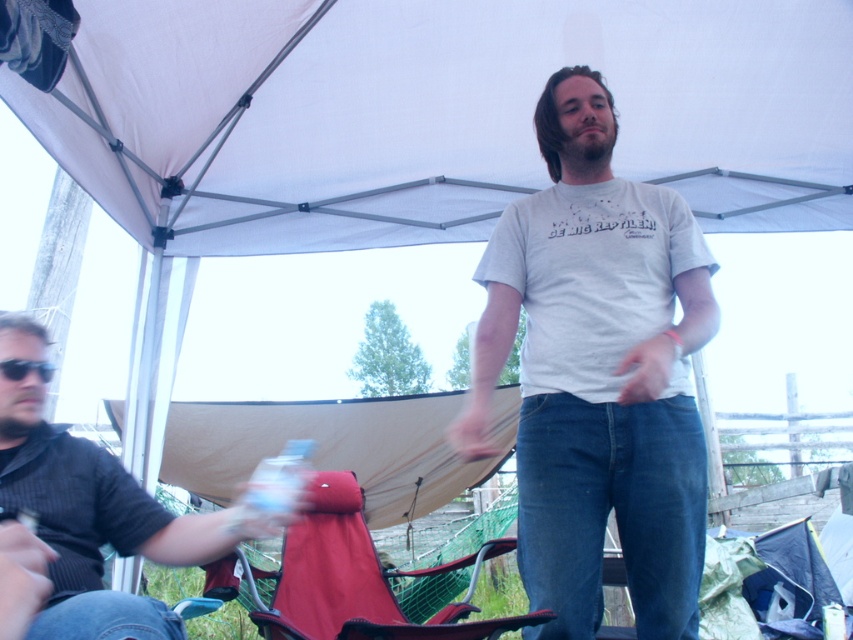
You are standing at the point marked by coordinates point (805, 76) and want to walk towards the point marked by coordinates point (3, 448). Will you have to go forward or backward to reach your destination?

Since point (805, 76) is behind point (3, 448), you will have to go forward to reach the destination.

You are standing at the point with coordinates (352, 579) in the image. What object is right there?

The matte red folding chair at lower center is located at point (352, 579).

You are a person who needs to reach the black plastic sunglasses at left from the matte red folding chair at lower center. Can you do it without moving more than 5 feet?

The matte red folding chair at lower center is 5.05 feet away from the black plastic sunglasses at left, so you cannot reach the black plastic sunglasses at left without moving more than 5 feet because the distance is slightly over the limit.